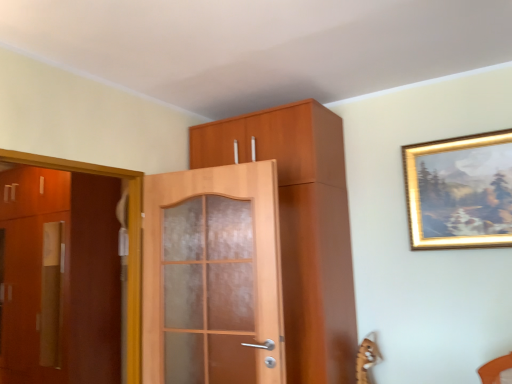
This screenshot has width=512, height=384. Find the location of `matte wood door at center, positioned as the 1th door in right-to-left order`. matte wood door at center, positioned as the 1th door in right-to-left order is located at coordinates (213, 273).

Describe the element at coordinates (301, 228) in the screenshot. Image resolution: width=512 pixels, height=384 pixels. I see `matte wood cabinet at center` at that location.

What is the approximate width of matte wood cabinet at center?

matte wood cabinet at center is 50.90 centimeters wide.

Where is `gold-framed painting at upper right`? gold-framed painting at upper right is located at coordinates pyautogui.click(x=460, y=191).

Measure the distance between point (417,204) and camera.

8.41 feet.

What are the coordinates of `matte brown cabinet at left, the 1th door positioned from the back` in the screenshot? It's located at (60, 277).

Can you confirm if matte wood door at center, which appears as the first door when viewed from the front, is wider than matte brown cabinet at left, marked as the 2th door in a front-to-back arrangement?

In fact, matte wood door at center, which appears as the first door when viewed from the front, might be narrower than matte brown cabinet at left, marked as the 2th door in a front-to-back arrangement.

Considering the positions of objects matte wood door at center, positioned as the 1th door in right-to-left order, and matte brown cabinet at left, marked as the 2th door in a front-to-back arrangement, in the image provided, who is more to the left, matte wood door at center, positioned as the 1th door in right-to-left order, or matte brown cabinet at left, marked as the 2th door in a front-to-back arrangement,?

Positioned to the left is matte brown cabinet at left, marked as the 2th door in a front-to-back arrangement.

You are a GUI agent. You are given a task and a screenshot of the screen. Output one action in this format:
    pyautogui.click(x=<x>, y=<y>)
    Task: Click on the door in front of the matte brown cabinet at left, the 1th door positioned from the back
    
    Given the screenshot: What is the action you would take?
    click(x=213, y=273)

From the image's perspective, is matte wood door at center, which is counted as the second door, starting from the left, located beneath matte brown cabinet at left, the 1th door positioned from the left?

No.

Consider the image. Measure the distance from matte brown cabinet at left, which is counted as the 2th door, starting from the right, to matte wood door at center, which is counted as the second door, starting from the left.

The distance of matte brown cabinet at left, which is counted as the 2th door, starting from the right, from matte wood door at center, which is counted as the second door, starting from the left, is 5.10 feet.

Considering the relative sizes of matte brown cabinet at left, the 1th door positioned from the left, and matte wood door at center, which appears as the first door when viewed from the front, in the image provided, is matte brown cabinet at left, the 1th door positioned from the left, smaller than matte wood door at center, which appears as the first door when viewed from the front,?

No.

Is matte brown cabinet at left, which is counted as the 2th door, starting from the right, turned away from matte wood door at center, which appears as the first door when viewed from the front?

matte brown cabinet at left, which is counted as the 2th door, starting from the right, does not have its back to matte wood door at center, which appears as the first door when viewed from the front.

From the image's perspective, who appears lower, matte brown cabinet at left, marked as the 2th door in a front-to-back arrangement, or matte wood door at center, which is counted as the second door, starting from the back?

From the image's view, matte brown cabinet at left, marked as the 2th door in a front-to-back arrangement, is below.

Visually, is matte wood cabinet at center positioned to the left or to the right of matte brown cabinet at left, the 1th door positioned from the back?

In the image, matte wood cabinet at center appears on the right side of matte brown cabinet at left, the 1th door positioned from the back.

Is matte wood cabinet at center wider or thinner than matte brown cabinet at left, the 1th door positioned from the back?

matte wood cabinet at center is thinner than matte brown cabinet at left, the 1th door positioned from the back.

Is matte wood cabinet at center bigger or smaller than matte brown cabinet at left, marked as the 2th door in a front-to-back arrangement?

In the image, matte wood cabinet at center appears to be smaller than matte brown cabinet at left, marked as the 2th door in a front-to-back arrangement.

The image size is (512, 384). Identify the location of cabinetry that is above the matte brown cabinet at left, which is counted as the 2th door, starting from the right (from a real-world perspective). (301, 228).

Where is `picture frame on the right of matte wood door at center, which appears as the first door when viewed from the front`? This screenshot has height=384, width=512. picture frame on the right of matte wood door at center, which appears as the first door when viewed from the front is located at coordinates pos(460,191).

Between matte wood door at center, which is counted as the second door, starting from the left, and gold-framed painting at upper right, which one has less height?

gold-framed painting at upper right is shorter.

Can you tell me how much matte wood door at center, which appears as the first door when viewed from the front, and gold-framed painting at upper right differ in facing direction?

A: matte wood door at center, which appears as the first door when viewed from the front, and gold-framed painting at upper right are facing 10.3 degrees away from each other.

Considering the positions of point (194, 280) and point (499, 200), is point (194, 280) closer or farther from the camera than point (499, 200)?

Point (194, 280) appears to be farther away from the viewer than point (499, 200).

Considering their positions, is matte wood cabinet at center located in front of or behind gold-framed painting at upper right?

In the image, matte wood cabinet at center appears in front of gold-framed painting at upper right.

Considering the sizes of objects matte wood cabinet at center and gold-framed painting at upper right in the image provided, who is thinner, matte wood cabinet at center or gold-framed painting at upper right?

gold-framed painting at upper right is thinner.

Is gold-framed painting at upper right completely or partially inside matte wood cabinet at center?

No, gold-framed painting at upper right is not a part of matte wood cabinet at center.

Which object is positioned more to the right, matte wood cabinet at center or gold-framed painting at upper right?

gold-framed painting at upper right is more to the right.

From the image's perspective, is matte wood cabinet at center below matte wood door at center, which is counted as the second door, starting from the left?

No, from the image's perspective, matte wood cabinet at center is not below matte wood door at center, which is counted as the second door, starting from the left.

You are a GUI agent. You are given a task and a screenshot of the screen. Output one action in this format:
    pyautogui.click(x=<x>, y=<y>)
    Task: Click on the 1st door below the matte wood cabinet at center (from the image's perspective)
    
    Given the screenshot: What is the action you would take?
    pyautogui.click(x=213, y=273)

Which object is closer to the camera, matte wood cabinet at center or matte wood door at center, positioned as the 1th door in right-to-left order?

matte wood door at center, positioned as the 1th door in right-to-left order, is closer to the camera.

Could you tell me if matte wood door at center, which appears as the first door when viewed from the front, is turned towards matte wood cabinet at center?

Yes, matte wood door at center, which appears as the first door when viewed from the front, is facing matte wood cabinet at center.

Which point is more forward, (209, 353) or (352, 333)?

The point (209, 353) is in front.

From a real-world perspective, is matte wood door at center, positioned as the 1th door in right-to-left order, under matte wood cabinet at center?

Yes, from a real-world perspective, matte wood door at center, positioned as the 1th door in right-to-left order, is below matte wood cabinet at center.

Does matte wood door at center, which is counted as the second door, starting from the back, have a greater width compared to matte wood cabinet at center?

Incorrect, the width of matte wood door at center, which is counted as the second door, starting from the back, does not surpass that of matte wood cabinet at center.

Where is `door below the matte wood door at center, which is counted as the second door, starting from the back (from a real-world perspective)`? This screenshot has width=512, height=384. door below the matte wood door at center, which is counted as the second door, starting from the back (from a real-world perspective) is located at coordinates (60, 277).

Where is `door lying below the matte wood door at center, which is counted as the second door, starting from the back (from the image's perspective)`? door lying below the matte wood door at center, which is counted as the second door, starting from the back (from the image's perspective) is located at coordinates (60, 277).

Which object lies nearer to the anchor point matte wood cabinet at center, matte brown cabinet at left, marked as the 2th door in a front-to-back arrangement, or gold-framed painting at upper right?

gold-framed painting at upper right.

Based on their spatial positions, is matte wood cabinet at center or gold-framed painting at upper right closer to matte brown cabinet at left, which is counted as the 2th door, starting from the right?

matte wood cabinet at center.

Based on their spatial positions, is matte brown cabinet at left, marked as the 2th door in a front-to-back arrangement, or matte wood door at center, which appears as the first door when viewed from the front, further from matte wood cabinet at center?

matte brown cabinet at left, marked as the 2th door in a front-to-back arrangement, is positioned further to the anchor matte wood cabinet at center.

Looking at the image, which one is located further to matte wood door at center, which appears as the first door when viewed from the front, matte wood cabinet at center or matte brown cabinet at left, which is counted as the 2th door, starting from the right?

The object further to matte wood door at center, which appears as the first door when viewed from the front, is matte brown cabinet at left, which is counted as the 2th door, starting from the right.

Based on their spatial positions, is matte wood cabinet at center or matte wood door at center, positioned as the 1th door in right-to-left order, further from gold-framed painting at upper right?

matte wood door at center, positioned as the 1th door in right-to-left order, is further to gold-framed painting at upper right.

When comparing their distances from matte wood cabinet at center, does gold-framed painting at upper right or matte brown cabinet at left, which is counted as the 2th door, starting from the right, seem further?

matte brown cabinet at left, which is counted as the 2th door, starting from the right, is further to matte wood cabinet at center.

Considering their positions, is matte brown cabinet at left, the 1th door positioned from the left, positioned closer to gold-framed painting at upper right than matte wood door at center, which is counted as the second door, starting from the left?

The object closer to gold-framed painting at upper right is matte wood door at center, which is counted as the second door, starting from the left.

From the image, which object appears to be farther from matte brown cabinet at left, the 1th door positioned from the back, gold-framed painting at upper right or matte wood cabinet at center?

gold-framed painting at upper right lies further to matte brown cabinet at left, the 1th door positioned from the back, than the other object.

Where is `cabinetry between matte brown cabinet at left, which is counted as the 2th door, starting from the right, and gold-framed painting at upper right, in the horizontal direction`? The height and width of the screenshot is (384, 512). cabinetry between matte brown cabinet at left, which is counted as the 2th door, starting from the right, and gold-framed painting at upper right, in the horizontal direction is located at coordinates (301, 228).

Find the location of a particular element. cabinetry located between matte wood door at center, which is counted as the second door, starting from the left, and gold-framed painting at upper right in the left-right direction is located at coordinates (301, 228).

Locate an element on the screen. Image resolution: width=512 pixels, height=384 pixels. door situated between matte brown cabinet at left, the 1th door positioned from the left, and gold-framed painting at upper right from left to right is located at coordinates (213, 273).

Where is `door between matte brown cabinet at left, the 1th door positioned from the back, and matte wood cabinet at center, in the horizontal direction`? The height and width of the screenshot is (384, 512). door between matte brown cabinet at left, the 1th door positioned from the back, and matte wood cabinet at center, in the horizontal direction is located at coordinates [213, 273].